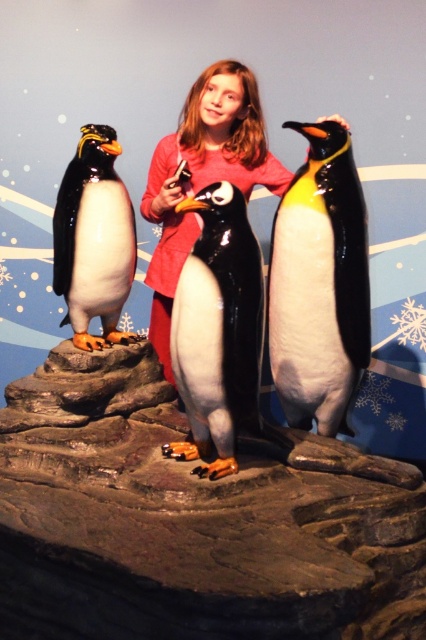
Question: Which point appears closest to the camera in this image?

Choices:
 (A) (230, 336)
 (B) (397, 538)
 (C) (362, 264)
 (D) (94, 129)

Answer: (B)

Question: Does glossy black penguin at center appear on the left side of matte pink shirt at center?

Choices:
 (A) no
 (B) yes

Answer: (A)

Question: Can you confirm if glossy black penguin at right is positioned below glossy black penguin at center?

Choices:
 (A) no
 (B) yes

Answer: (A)

Question: Is smooth gray rock at center closer to camera compared to glossy black penguin at center?

Choices:
 (A) yes
 (B) no

Answer: (A)

Question: Which is farther from the shiny black penguin at left?

Choices:
 (A) glossy black penguin at right
 (B) smooth gray rock at center

Answer: (A)

Question: Considering the real-world distances, which object is closest to the smooth gray rock at center?

Choices:
 (A) shiny black penguin at left
 (B) glossy black penguin at center

Answer: (B)